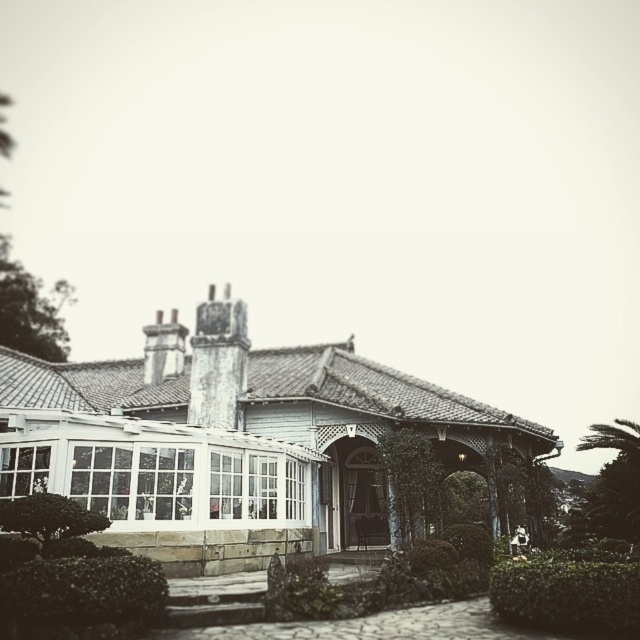
Question: Which point is closer to the camera taking this photo?

Choices:
 (A) (141, 582)
 (B) (632, 570)

Answer: (A)

Question: Which object is closer to the camera taking this photo?

Choices:
 (A) white glass conservatory at center
 (B) green leafy hedge at lower right
 (C) green leafy hedge at lower left

Answer: (C)

Question: Does green leafy hedge at lower left have a smaller size compared to green leafy hedge at lower right?

Choices:
 (A) yes
 (B) no

Answer: (A)

Question: Which of the following is the farthest from the observer?

Choices:
 (A) white glass conservatory at center
 (B) green leafy hedge at lower left
 (C) green leafy hedge at lower right

Answer: (A)

Question: Can you confirm if white glass conservatory at center is positioned to the right of green leafy hedge at lower right?

Choices:
 (A) yes
 (B) no

Answer: (B)

Question: Is white glass conservatory at center closer to camera compared to green leafy hedge at lower left?

Choices:
 (A) yes
 (B) no

Answer: (B)